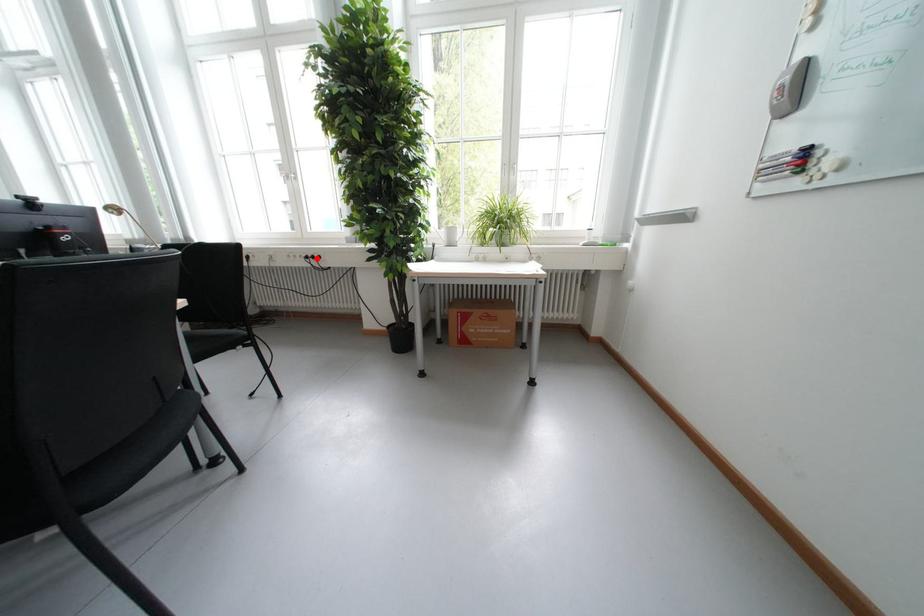
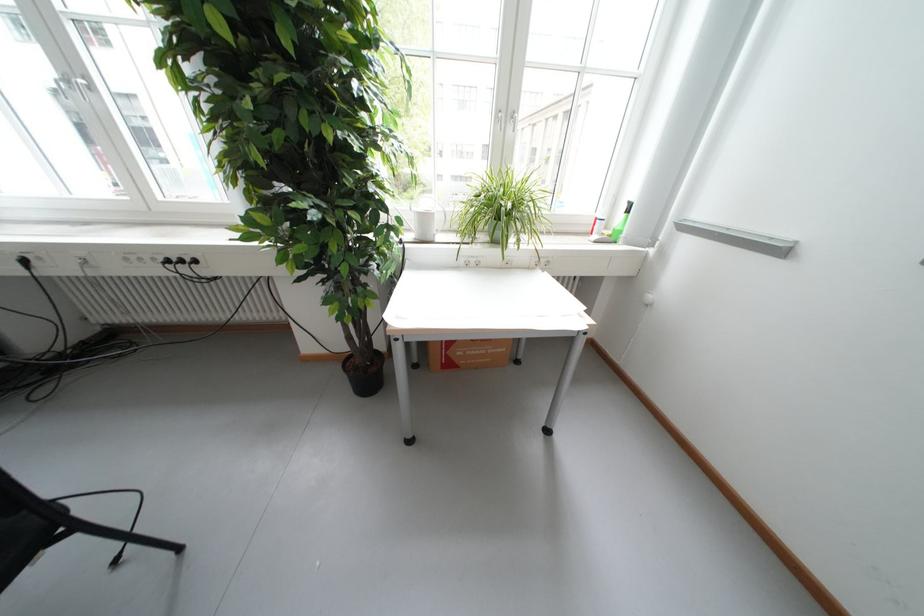
The point at the highlighted location is marked in the first image. Where is the corresponding point in the second image?

(177, 262)